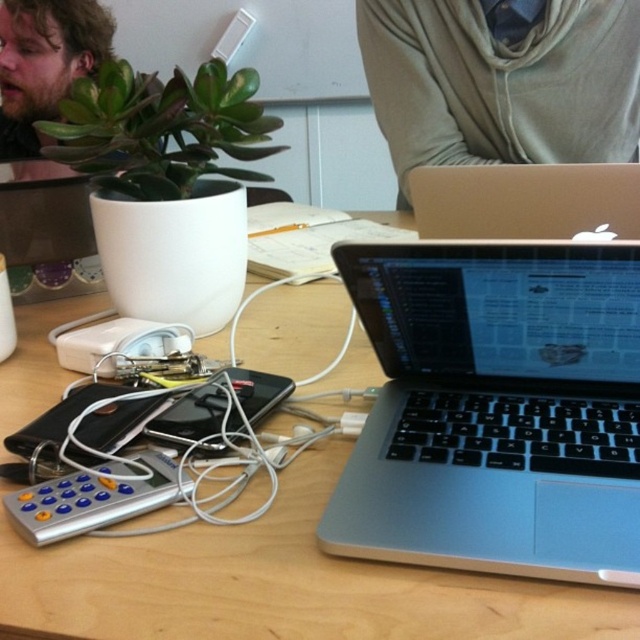
Does silver metallic laptop at center appear over silver/plastic remote at lower left?

Yes.

Is point (452, 227) positioned after point (77, 483)?

Yes, point (452, 227) is behind point (77, 483).

Where is `silver metallic laptop at center`? silver metallic laptop at center is located at coordinates [x=524, y=200].

Is the position of wooden table at center less distant than that of bearded man at upper left?

Yes, it is in front of bearded man at upper left.

Between wooden table at center and bearded man at upper left, which one is positioned lower?

wooden table at center is lower down.

Which is in front, point (220, 621) or point (33, 74)?

Positioned in front is point (220, 621).

Where is `wooden table at center`? This screenshot has width=640, height=640. wooden table at center is located at coordinates (278, 582).

Is silver/black keyboard at center closer to camera compared to bearded man at upper left?

That is True.

Does silver/black keyboard at center appear over bearded man at upper left?

Actually, silver/black keyboard at center is below bearded man at upper left.

Find the location of a particular element. This screenshot has height=640, width=640. silver/black keyboard at center is located at coordinates (497, 410).